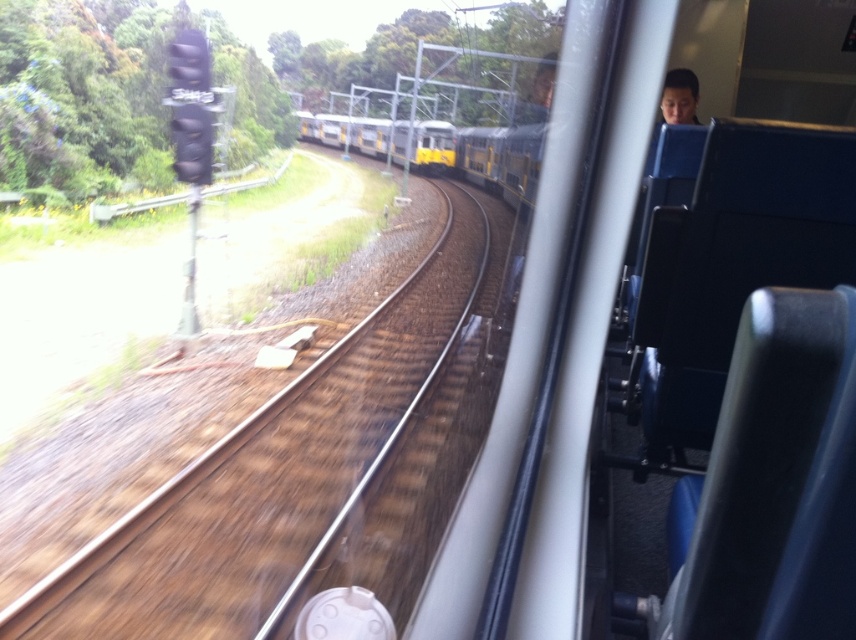
Question: Can you confirm if yellow metallic train at center is positioned to the left of smooth skin face at upper right?

Choices:
 (A) yes
 (B) no

Answer: (A)

Question: Which of the following is the closest to the observer?

Choices:
 (A) yellow matte train at center
 (B) yellow metallic train at center

Answer: (A)

Question: Which object is farther from the camera taking this photo?

Choices:
 (A) smooth skin face at upper right
 (B) brown gravel train track at left
 (C) yellow matte train at center
 (D) yellow metallic train at center

Answer: (D)

Question: Is yellow metallic train at center positioned in front of smooth skin face at upper right?

Choices:
 (A) no
 (B) yes

Answer: (A)

Question: Does brown gravel train track at left lie behind yellow matte train at center?

Choices:
 (A) yes
 (B) no

Answer: (B)

Question: Among these objects, which one is nearest to the camera?

Choices:
 (A) yellow metallic train at center
 (B) yellow matte train at center

Answer: (B)